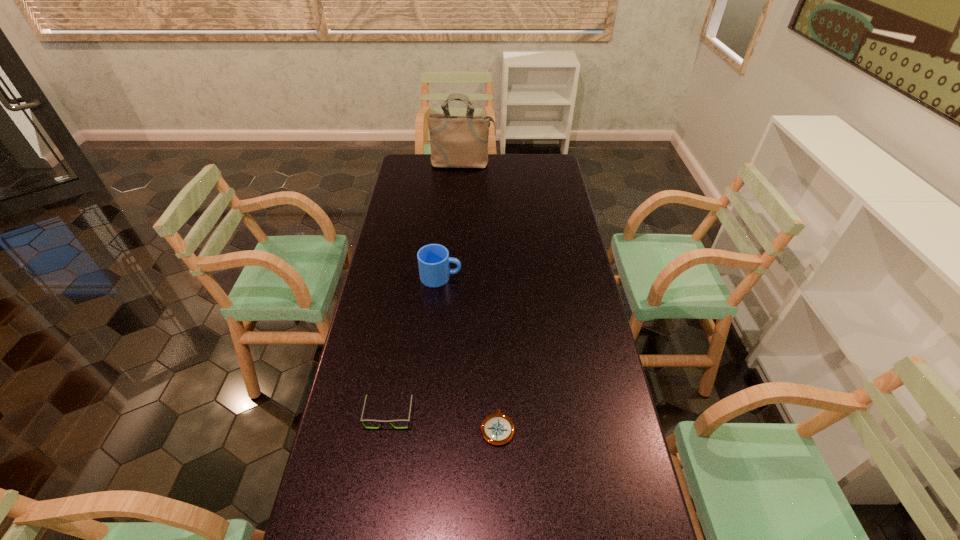
Find the location of a particular element. This screenshot has height=540, width=960. shoulder bag is located at coordinates (456, 142).

Where is `the tallest object`? Image resolution: width=960 pixels, height=540 pixels. the tallest object is located at coordinates (456, 142).

This screenshot has width=960, height=540. I want to click on the third shortest object, so click(434, 262).

Find the location of a particular element. The width and height of the screenshot is (960, 540). the third nearest object is located at coordinates (434, 262).

The width and height of the screenshot is (960, 540). In order to click on the third tallest object in this screenshot , I will do `click(367, 420)`.

Locate an element on the screen. the shortest object is located at coordinates (497, 429).

Locate an element on the screen. This screenshot has height=540, width=960. vacant space situated on the front-facing side of the tallest object is located at coordinates (461, 209).

Where is `free spot located 0.100m on the side of the second tallest object with the handle`? The image size is (960, 540). free spot located 0.100m on the side of the second tallest object with the handle is located at coordinates (490, 277).

You are a GUI agent. You are given a task and a screenshot of the screen. Output one action in this format:
    pyautogui.click(x=<x>, y=<y>)
    Task: Click on the vacant space located 0.150m on the lens of the spectacles
    The height and width of the screenshot is (540, 960).
    Given the screenshot: What is the action you would take?
    pyautogui.click(x=378, y=487)

This screenshot has width=960, height=540. I want to click on vacant space situated on the front of the shortest object, so click(x=500, y=496).